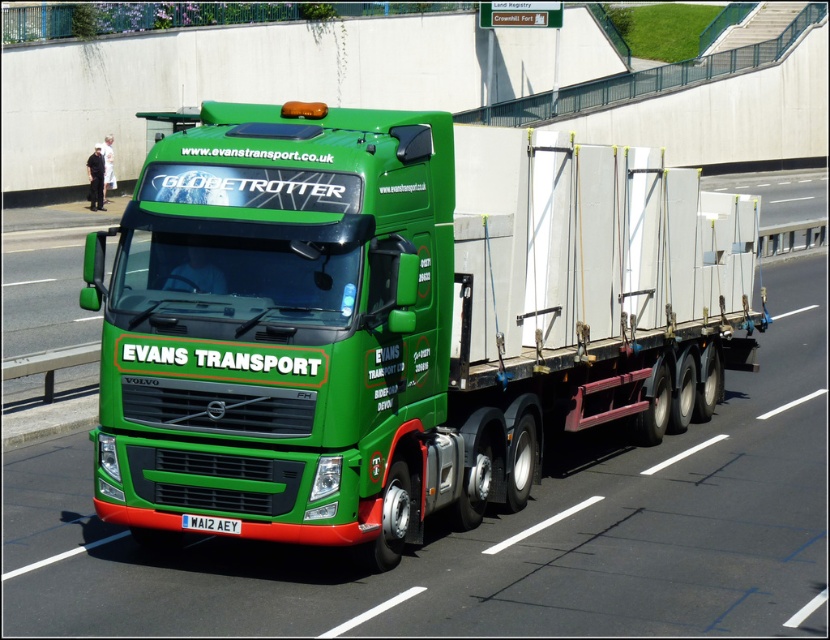
You are a delivery driver who needs to enter a low clearance tunnel. The tunnel has a height limit of 3 meters. You are driving the green matte truck at center which has a white plastic license plate at center. Based on their sizes, can you estimate if the truck will fit under the tunnel?

The green matte truck at center is much taller than the white plastic license plate at center, so it is likely that the truck exceeds the 3 meter height limit and may not fit under the tunnel.

You are standing at a distance from the Evans Transport truck and want to know how far the point at coordinates point (243, 154) is from you. Can you determine the distance?

The point (243, 154) is 25.29 feet from the viewer.

You are standing at the point marked as point [398,317]. What object is located exactly at this point?

The point [398,317] is exactly where the green matte truck at center is located.